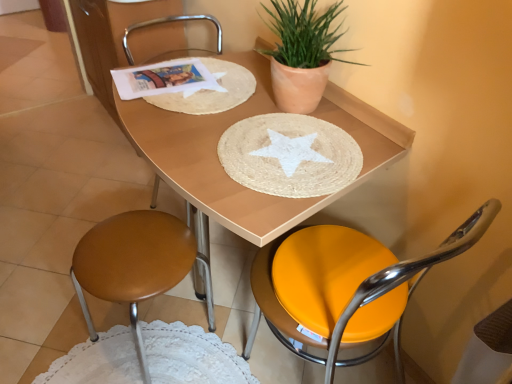
Where is `empty space that is ontop of white woven placemat at upper left, the second paper plate when ordered from bottom to top (from a real-world perspective)`? empty space that is ontop of white woven placemat at upper left, the second paper plate when ordered from bottom to top (from a real-world perspective) is located at coordinates (199, 80).